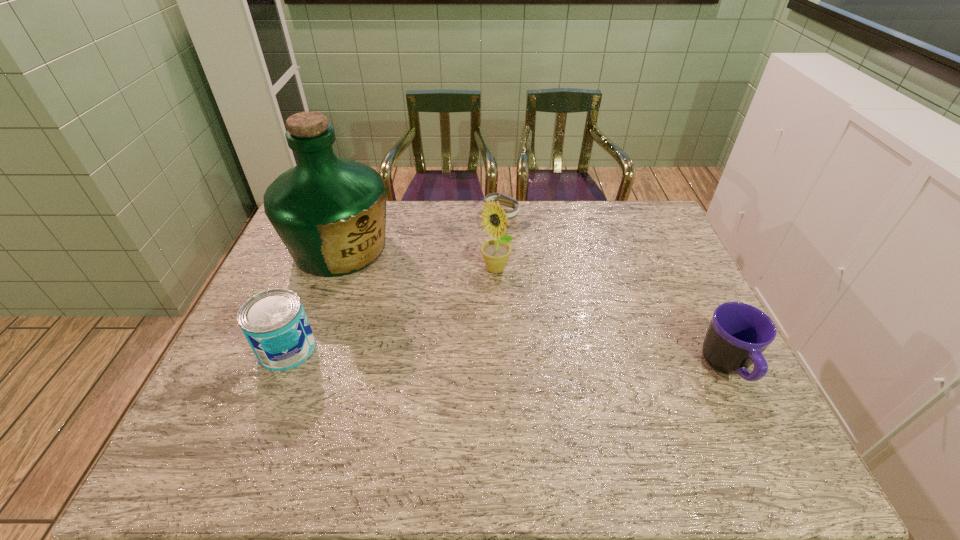
The height and width of the screenshot is (540, 960). I want to click on vacant space at the near right corner of the desktop, so click(691, 407).

Identify the location of free point between the tallest object and the fourth shortest object. The height and width of the screenshot is (540, 960). (418, 259).

Where is `empty location between the fourth shortest object and the can`? This screenshot has width=960, height=540. empty location between the fourth shortest object and the can is located at coordinates (391, 309).

At what (x,y) coordinates should I click in order to perform the action: click on vacant space that's between the shortest object and the liquor. Please return your answer as a coordinate pair (x, y). This screenshot has height=540, width=960. Looking at the image, I should click on (420, 232).

At what (x,y) coordinates should I click in order to perform the action: click on empty space between the tallest object and the shortest object. Please return your answer as a coordinate pair (x, y). The width and height of the screenshot is (960, 540). Looking at the image, I should click on (420, 232).

Identify the location of vacant area that lies between the liquor and the rightmost object. Image resolution: width=960 pixels, height=540 pixels. (534, 308).

The image size is (960, 540). In order to click on free point between the shortest object and the can in this screenshot , I will do `click(394, 282)`.

Where is `free space between the can and the sunflower`? free space between the can and the sunflower is located at coordinates (391, 309).

At what (x,y) coordinates should I click in order to perform the action: click on empty location between the can and the mug. Please return your answer as a coordinate pair (x, y). This screenshot has height=540, width=960. Looking at the image, I should click on (508, 359).

Find the location of a particular element. Image resolution: width=960 pixels, height=540 pixels. vacant space that is in between the tallest object and the watch is located at coordinates (420, 232).